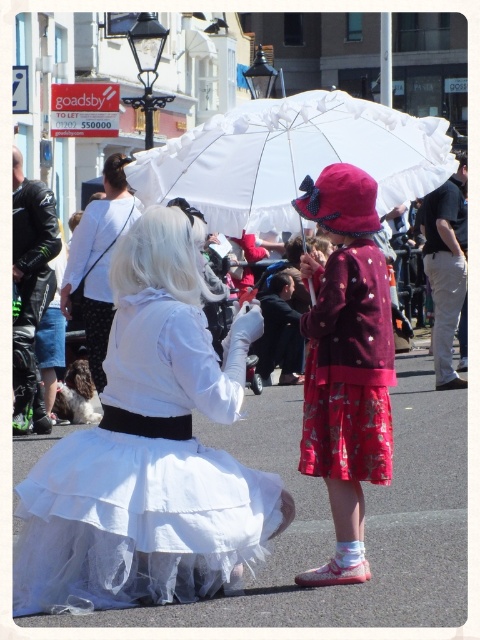
Who is higher up, matte burgundy coat at center or black cotton shirt at right?

black cotton shirt at right is higher up.

At what (x,y) coordinates should I click in order to perform the action: click on matte burgundy coat at center. Please return your answer as a coordinate pair (x, y). Looking at the image, I should click on (346, 362).

This screenshot has height=640, width=480. Identify the location of matte burgundy coat at center. (346, 362).

Does white tulle skirt at center appear on the right side of black cotton shirt at right?

In fact, white tulle skirt at center is to the left of black cotton shirt at right.

What do you see at coordinates (148, 452) in the screenshot?
I see `white tulle skirt at center` at bounding box center [148, 452].

Find the location of `white tulle skirt at center`. white tulle skirt at center is located at coordinates (148, 452).

What do you see at coordinates (291, 157) in the screenshot? I see `white lace umbrella at upper center` at bounding box center [291, 157].

Which of these two, white lace umbrella at upper center or white satin dress at center, stands shorter?

white lace umbrella at upper center

This screenshot has width=480, height=640. I want to click on white lace umbrella at upper center, so click(x=291, y=157).